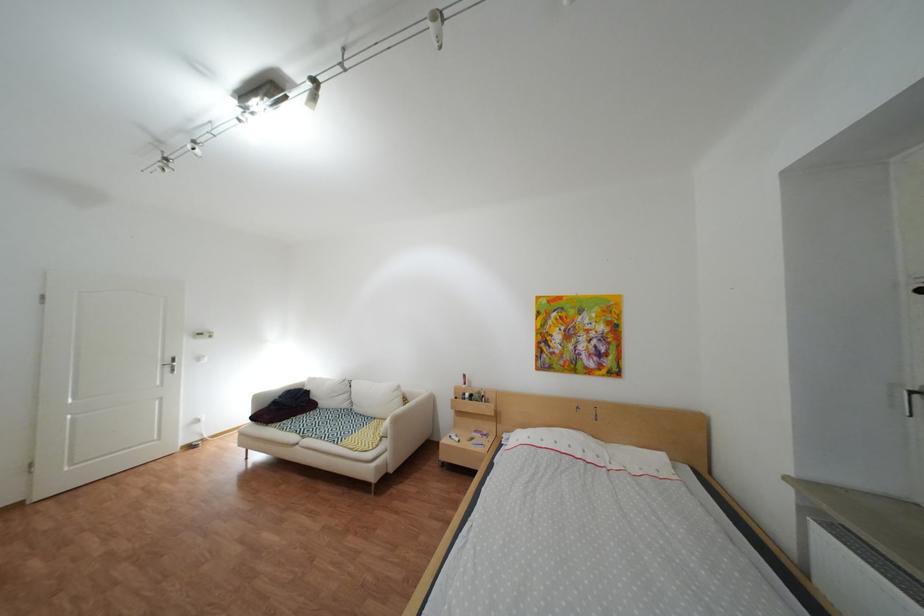
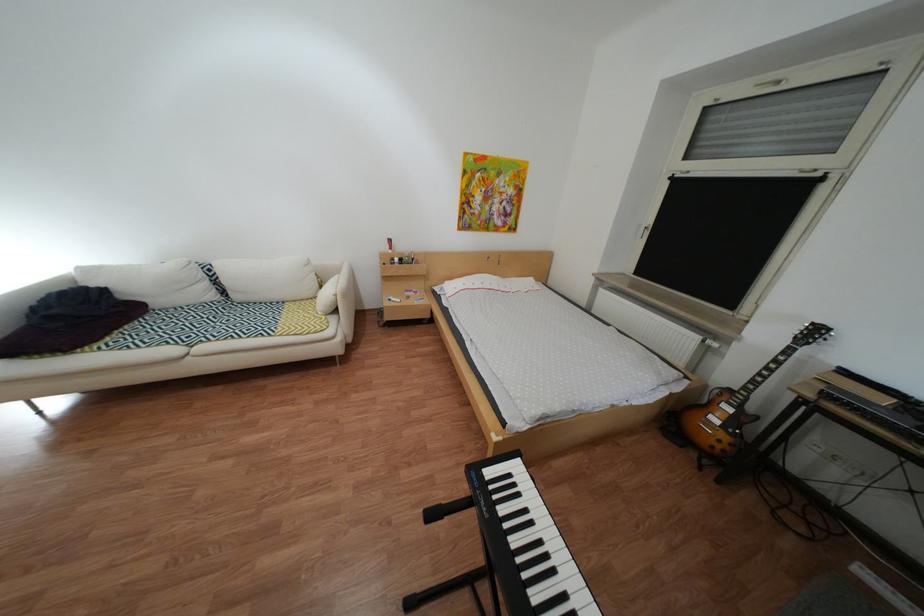
Locate, in the second image, the point that corresponds to point (294, 424) in the first image.

(113, 346)